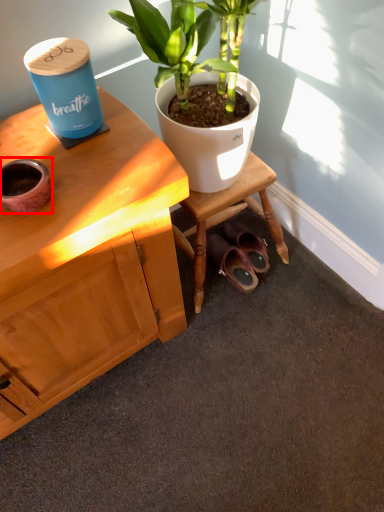
Question: Considering the relative positions of flowerpot (annotated by the red box) and footwear in the image provided, where is flowerpot (annotated by the red box) located with respect to the staircase?

Choices:
 (A) right
 (B) left

Answer: (B)